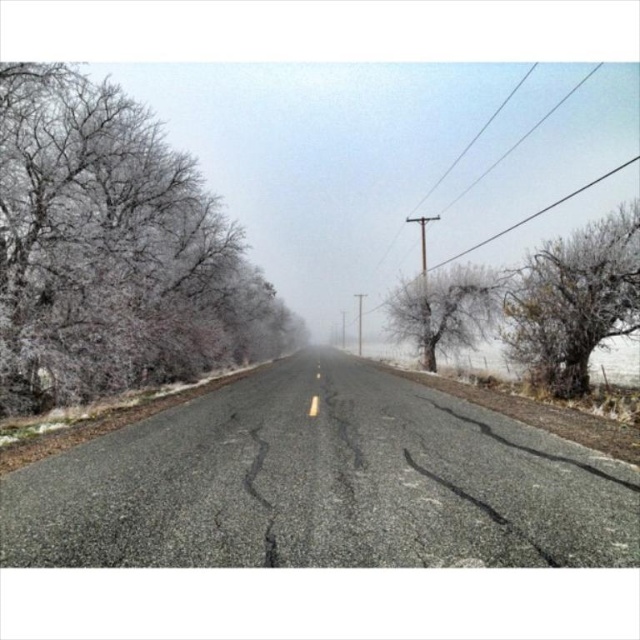
Who is more forward, (8, 397) or (432, 285)?

Point (8, 397) is more forward.

Which is behind, point (189, 291) or point (476, 312)?

The point (476, 312) is more distant.

The height and width of the screenshot is (640, 640). In order to click on frosted branches at left in this screenshot , I will do [x=113, y=250].

Based on the photo, which of these two, frosted branches at left or frosted bark tree at right, stands shorter?

Standing shorter between the two is frosted bark tree at right.

Does frosted branches at left appear on the left side of frosted bark tree at right?

Yes, frosted branches at left is to the left of frosted bark tree at right.

Locate an element on the screen. This screenshot has width=640, height=640. frosted branches at left is located at coordinates coord(113,250).

Where is `frosted branches at left`? The width and height of the screenshot is (640, 640). frosted branches at left is located at coordinates pos(113,250).

Who is lower down, frosted bark tree at right or frosted ice tree at center?

frosted ice tree at center

Which is behind, point (566, 324) or point (474, 284)?

Positioned behind is point (474, 284).

Which is in front, point (580, 376) or point (412, 321)?

Point (580, 376) is in front.

Where is `frosted bark tree at right`? frosted bark tree at right is located at coordinates (573, 301).